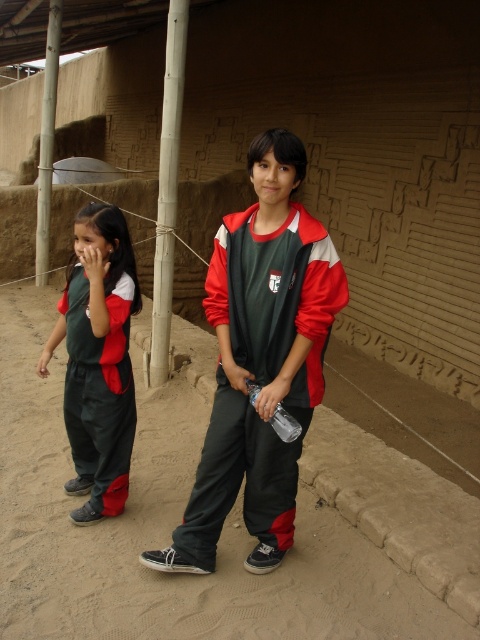
Question: In this image, where is dark gray sand at center located relative to matte green uniform at left?

Choices:
 (A) above
 (B) below

Answer: (B)

Question: Which point is farther to the camera?

Choices:
 (A) dark gray sand at center
 (B) matte green uniform at left

Answer: (B)

Question: Among these objects, which one is nearest to the camera?

Choices:
 (A) matte green jacket at center
 (B) matte green uniform at left
 (C) dark gray sand at center
 (D) clear plastic bottle at center

Answer: (A)

Question: Does dark gray sand at center appear over matte green uniform at left?

Choices:
 (A) yes
 (B) no

Answer: (B)

Question: Does matte green uniform at left have a larger size compared to clear plastic bottle at center?

Choices:
 (A) yes
 (B) no

Answer: (A)

Question: Which object appears farthest from the camera in this image?

Choices:
 (A) clear plastic bottle at center
 (B) matte green jacket at center
 (C) matte green tracksuit at center

Answer: (A)